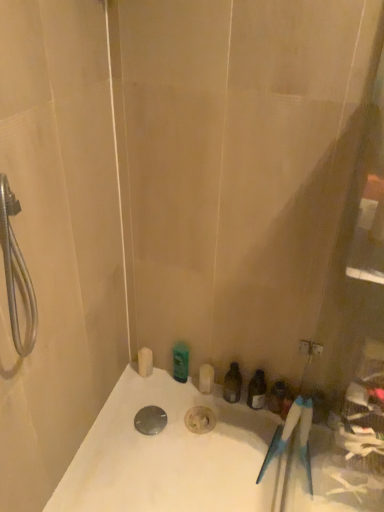
Identify the location of vacant space that's between matte plastic toiletries at lower right, which appears as the first toiletry when viewed from the right, and polished metallic drain at center. (196, 421).